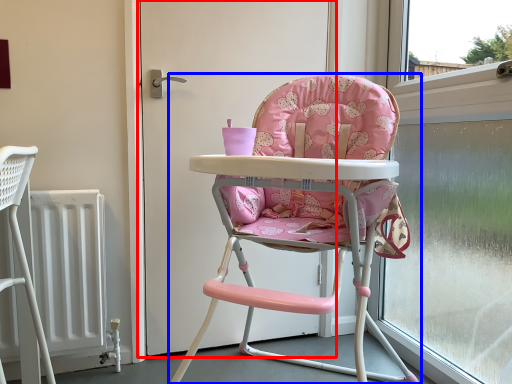
Question: Which point is further to the camera, screen door (highlighted by a red box) or chair (highlighted by a blue box)?

Choices:
 (A) screen door
 (B) chair

Answer: (A)